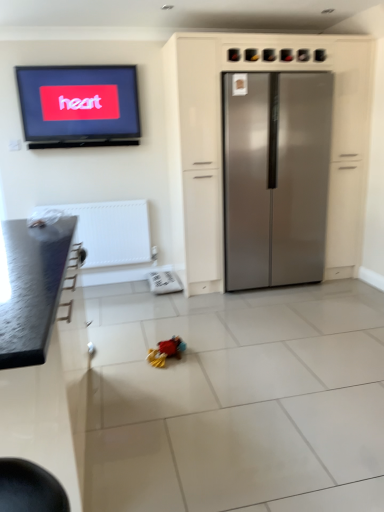
Question: From the image's perspective, is stainless steel refrigerator at center, the 2th cabinetry when ordered from left to right, under plush multicolored toy at center?

Choices:
 (A) yes
 (B) no

Answer: (B)

Question: Is stainless steel refrigerator at center, the 2th cabinetry when ordered from front to back, smaller than plush multicolored toy at center?

Choices:
 (A) no
 (B) yes

Answer: (A)

Question: Is stainless steel refrigerator at center, which appears as the first cabinetry when viewed from the back, further to camera compared to plush multicolored toy at center?

Choices:
 (A) yes
 (B) no

Answer: (A)

Question: Could you tell me if stainless steel refrigerator at center, the 2th cabinetry when ordered from front to back, is facing plush multicolored toy at center?

Choices:
 (A) no
 (B) yes

Answer: (B)

Question: Can you confirm if stainless steel refrigerator at center, which appears as the 1th cabinetry when viewed from the right, is shorter than plush multicolored toy at center?

Choices:
 (A) yes
 (B) no

Answer: (B)

Question: From a real-world perspective, is matte black television at upper left above or below plush multicolored toy at center?

Choices:
 (A) below
 (B) above

Answer: (B)

Question: From the image's perspective, is matte black television at upper left positioned above or below plush multicolored toy at center?

Choices:
 (A) below
 (B) above

Answer: (B)

Question: Is point (69, 122) closer or farther from the camera than point (152, 358)?

Choices:
 (A) farther
 (B) closer

Answer: (A)

Question: Considering the positions of matte black television at upper left and plush multicolored toy at center in the image, is matte black television at upper left wider or thinner than plush multicolored toy at center?

Choices:
 (A) thin
 (B) wide

Answer: (A)

Question: From the image's perspective, is plush multicolored toy at center above or below granite countertop at left, which appears as the 2th cabinetry when viewed from the back?

Choices:
 (A) above
 (B) below

Answer: (B)

Question: Considering their positions, is plush multicolored toy at center located in front of or behind granite countertop at left, the 1th cabinetry positioned from the front?

Choices:
 (A) behind
 (B) front

Answer: (A)

Question: Visually, is plush multicolored toy at center positioned to the left or to the right of granite countertop at left, which appears as the 2th cabinetry when viewed from the back?

Choices:
 (A) right
 (B) left

Answer: (A)

Question: Which is correct: plush multicolored toy at center is inside granite countertop at left, which ranks as the first cabinetry in left-to-right order, or outside of it?

Choices:
 (A) inside
 (B) outside

Answer: (B)

Question: Relative to plush multicolored toy at center, is satin silver refrigerator at center in front or behind?

Choices:
 (A) behind
 (B) front

Answer: (A)

Question: Looking at their shapes, would you say satin silver refrigerator at center is wider or thinner than plush multicolored toy at center?

Choices:
 (A) wide
 (B) thin

Answer: (A)